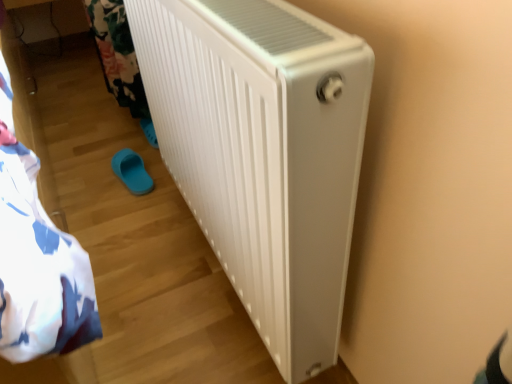
Question: From a real-world perspective, is white plastic radiator at center physically located above or below blue rubber slipper at lower left?

Choices:
 (A) above
 (B) below

Answer: (A)

Question: In the image, is white plastic radiator at center positioned in front of or behind blue rubber slipper at lower left?

Choices:
 (A) front
 (B) behind

Answer: (A)

Question: In terms of width, does white plastic radiator at center look wider or thinner when compared to blue rubber slipper at lower left?

Choices:
 (A) thin
 (B) wide

Answer: (B)

Question: Is blue rubber slipper at lower left in front of or behind white plastic radiator at center in the image?

Choices:
 (A) front
 (B) behind

Answer: (B)

Question: Does point (141, 190) appear closer or farther from the camera than point (266, 203)?

Choices:
 (A) farther
 (B) closer

Answer: (A)

Question: In the image, is blue rubber slipper at lower left on the left side or the right side of white plastic radiator at center?

Choices:
 (A) left
 (B) right

Answer: (A)

Question: In terms of size, does blue rubber slipper at lower left appear bigger or smaller than white plastic radiator at center?

Choices:
 (A) big
 (B) small

Answer: (B)